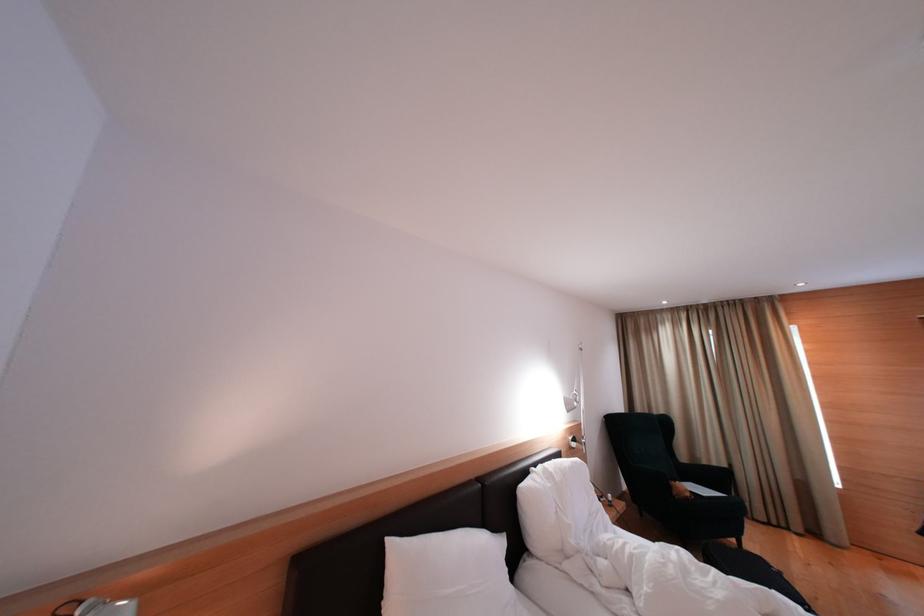
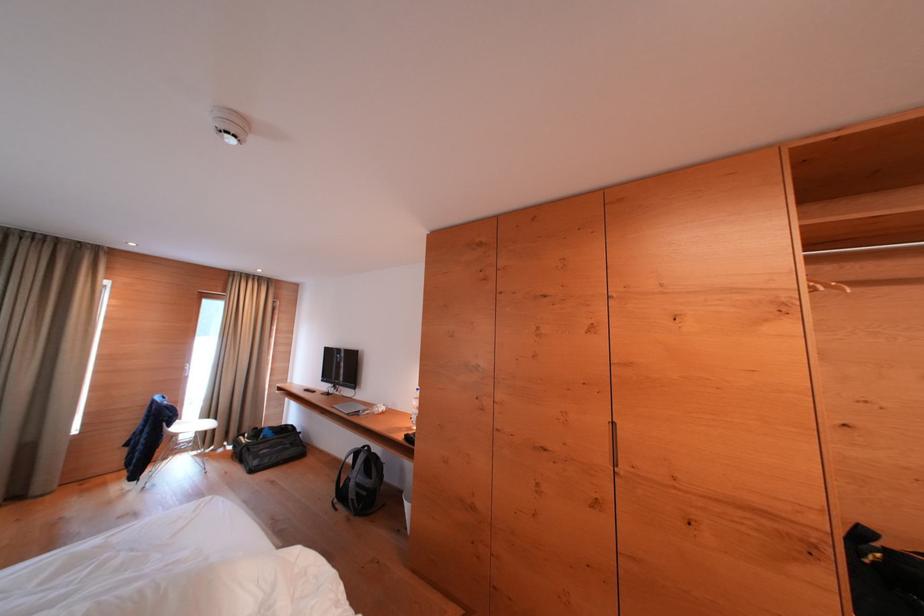
Question: Based on the continuous images, in which direction is the camera rotating? Reply with the corresponding letter.

Choices:
 (A) Left
 (B) Right
 (C) Up
 (D) Down

Answer: (B)